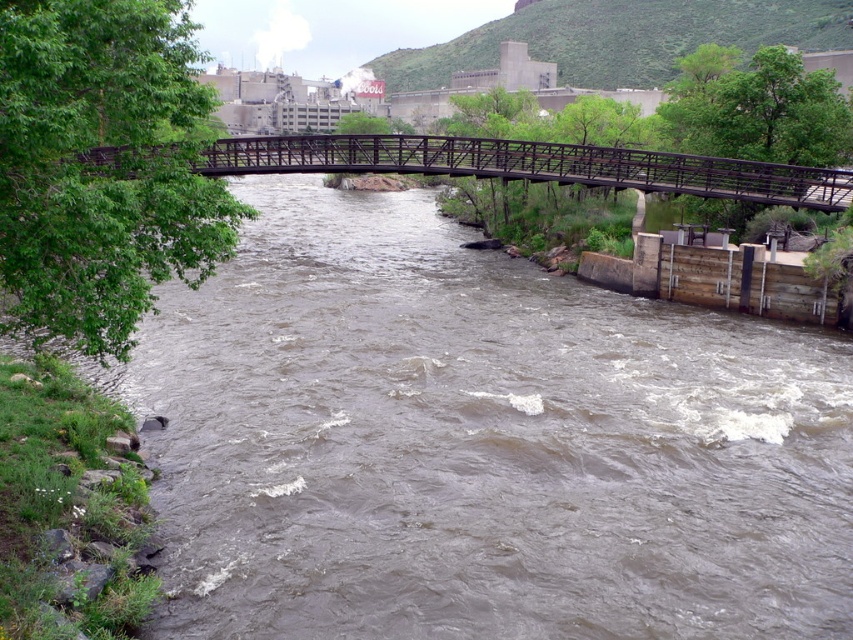
Does brown muddy water at center have a smaller size compared to metallic bridge at center?

No, brown muddy water at center is not smaller than metallic bridge at center.

Is brown muddy water at center thinner than metallic bridge at center?

Indeed, brown muddy water at center has a lesser width compared to metallic bridge at center.

Where is `brown muddy water at center`? This screenshot has height=640, width=853. brown muddy water at center is located at coordinates (479, 444).